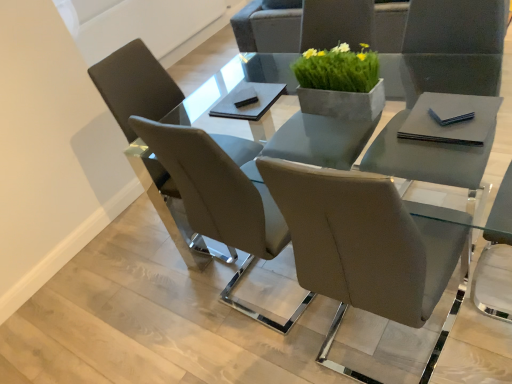
The image size is (512, 384). I want to click on free location to the left of clear glass table at center, so click(x=136, y=320).